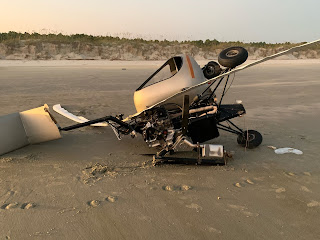
At what (x,y) coordinates should I click in order to perform the action: click on prints. Please return your answer as a coordinate pair (x, y). Looking at the image, I should click on (29, 206), (166, 188), (93, 204), (237, 184).